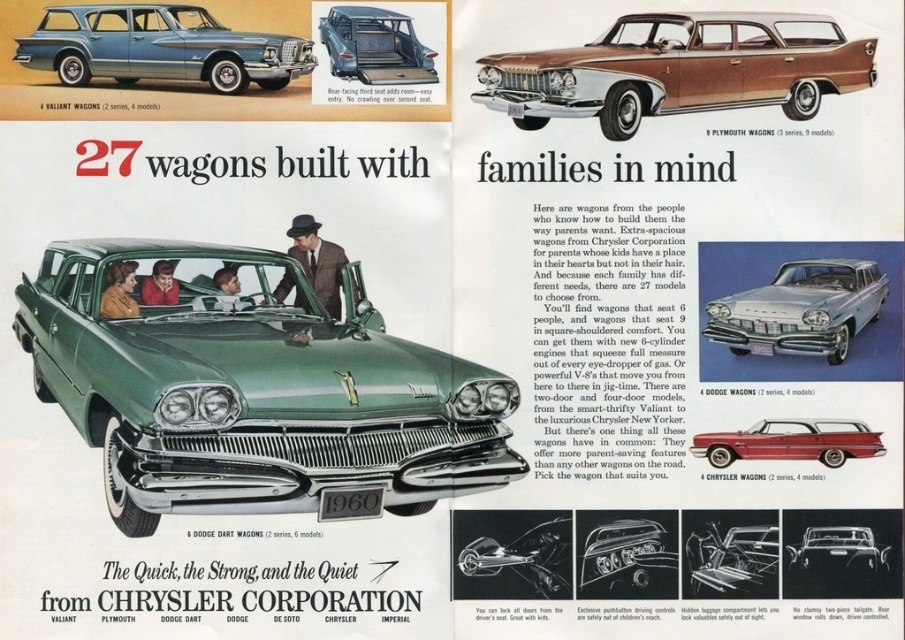
Question: Which object is positioned farthest from the shiny chrome grille at center?

Choices:
 (A) green metallic wagon at center
 (B) metallic silver sedan at center
 (C) metallic red wagon at center
 (D) metallic blue wagon at upper center

Answer: (D)

Question: Does metallic blue station wagon at upper left have a lesser width compared to metallic silver car at center?

Choices:
 (A) no
 (B) yes

Answer: (A)

Question: Which is farther from the metallic blue wagon at upper center?

Choices:
 (A) metallic blue station wagon at upper left
 (B) silver metallic sedan at center
 (C) shiny chrome handle at center
 (D) shiny chrome grille at center

Answer: (D)

Question: Which object appears closest to the camera in this image?

Choices:
 (A) shiny chrome grille at center
 (B) metallic silver car at center
 (C) metallic blue wagon at upper center

Answer: (B)

Question: Is the position of green metallic wagon at center more distant than that of metallic silver sedan at center?

Choices:
 (A) no
 (B) yes

Answer: (A)

Question: Is green metallic wagon at center wider than metallic blue station wagon at upper left?

Choices:
 (A) no
 (B) yes

Answer: (B)